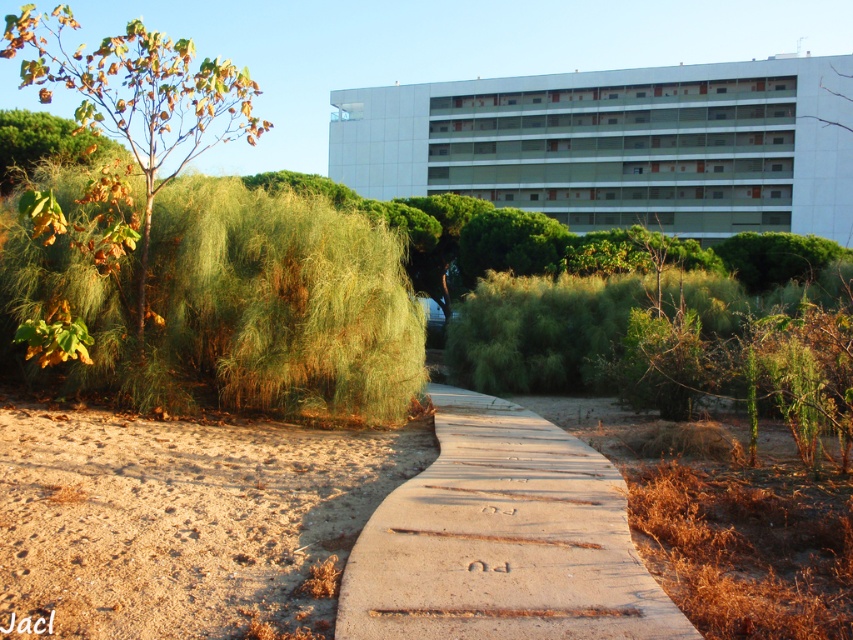
You are standing at the viewpoint of the image and want to reach the point marked as point (845, 189). If your walking speed is 3 feet per second, how many seconds will it take you to reach there?

The distance between you and point (845, 189) is 187.86 feet. At a walking speed of 3 feet per second, it would take approximately 62.62 seconds to reach there.

You are standing at the start of the curved concrete pathway in the image. The brown concrete pavement at center is part of this path. If you want to reach the end of the path, which is marked by the faint letters

The brown concrete pavement at center is 6.88 meters away from viewer. Since the path curves gently to the right and disappears into the greenery ahead, you would need to follow the curve of the path towards the right to reach its end marked by the faint letters.